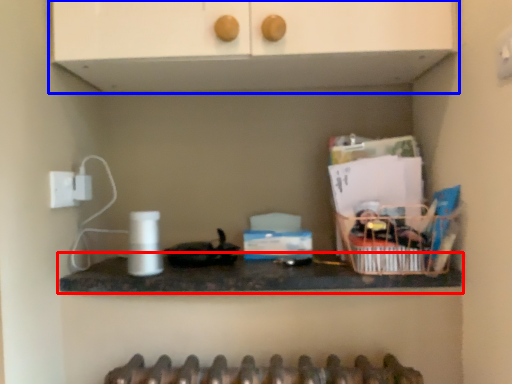
Question: Which point is further to the camera, countertop (highlighted by a red box) or cabinetry (highlighted by a blue box)?

Choices:
 (A) countertop
 (B) cabinetry

Answer: (A)